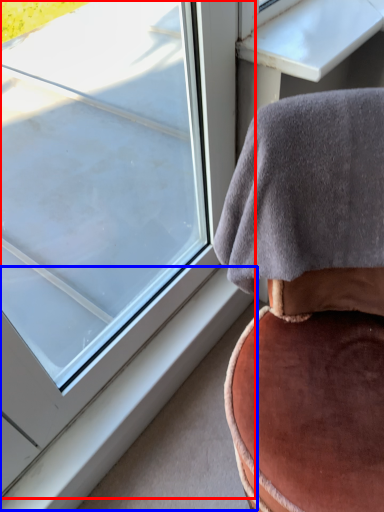
Question: Which object is closer to the camera taking this photo, window (highlighted by a red box) or window sill (highlighted by a blue box)?

Choices:
 (A) window
 (B) window sill

Answer: (A)